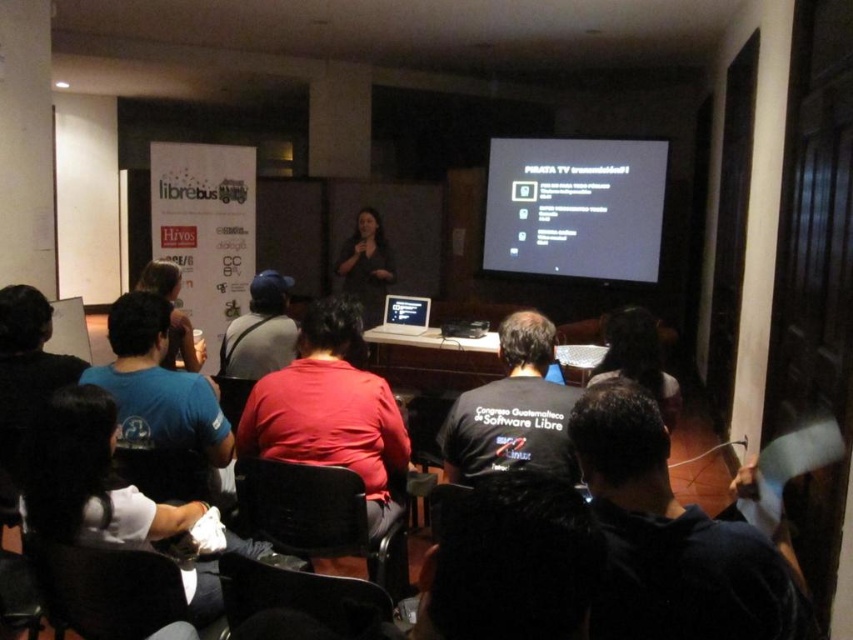
How distant is black fabric hair at center from dark gray shirt at center?

They are 8.09 feet apart.

Between black fabric hair at center and dark gray shirt at center, which one appears on the left side from the viewer's perspective?

From the viewer's perspective, dark gray shirt at center appears more on the left side.

You are a GUI agent. You are given a task and a screenshot of the screen. Output one action in this format:
    pyautogui.click(x=<x>, y=<y>)
    Task: Click on the black fabric hair at center
    
    Given the screenshot: What is the action you would take?
    tap(511, 563)

Where is `black fabric hair at center`? This screenshot has height=640, width=853. black fabric hair at center is located at coordinates (511, 563).

Is black fabric hair at center positioned at the back of white plastic laptop at center?

No.

What do you see at coordinates (511, 563) in the screenshot? The width and height of the screenshot is (853, 640). I see `black fabric hair at center` at bounding box center [511, 563].

Where is `black fabric hair at center`? The image size is (853, 640). black fabric hair at center is located at coordinates (511, 563).

Is white fabric shirt at lower center to the right of matte black shirt at center from the viewer's perspective?

Incorrect, white fabric shirt at lower center is not on the right side of matte black shirt at center.

Does point (111, 545) lie behind point (384, 275)?

No, (111, 545) is in front of (384, 275).

Does point (132, 497) lie in front of point (338, 257)?

Yes, point (132, 497) is closer to viewer.

Identify the location of white fabric shirt at lower center. This screenshot has height=640, width=853. (99, 483).